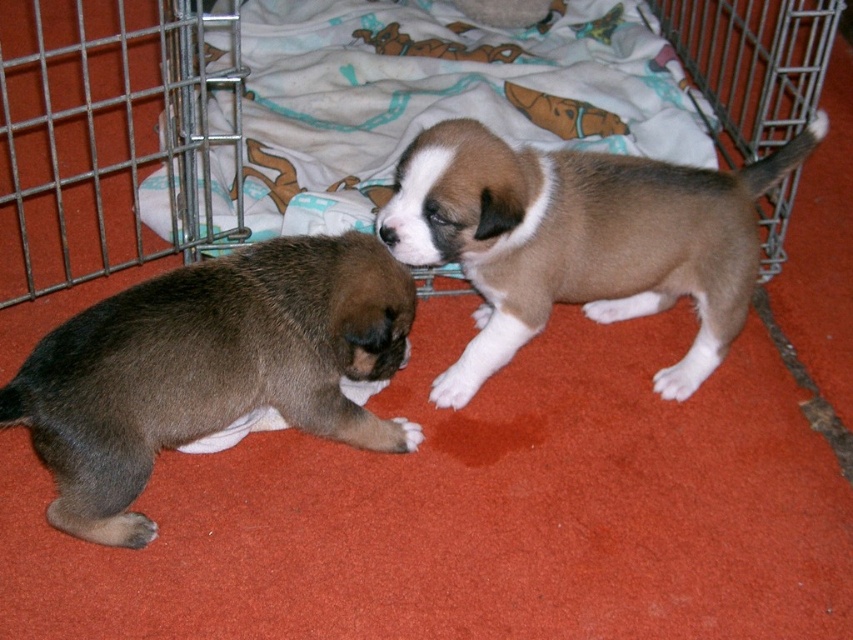
Can you confirm if brown fuzzy puppy at lower left is taller than brown fur puppy at center?

In fact, brown fuzzy puppy at lower left may be shorter than brown fur puppy at center.

Which of these two, brown fuzzy puppy at lower left or brown fur puppy at center, stands taller?

brown fur puppy at center is taller.

What are the coordinates of `brown fuzzy puppy at lower left` in the screenshot? It's located at (210, 369).

Find the location of a particular element. The height and width of the screenshot is (640, 853). brown fuzzy puppy at lower left is located at coordinates (210, 369).

Can you confirm if brown fuzzy puppy at lower left is thinner than metal wire cage at upper left?

Yes.

Does point (219, 333) come in front of point (108, 269)?

Yes, point (219, 333) is closer to viewer.

Image resolution: width=853 pixels, height=640 pixels. In order to click on brown fuzzy puppy at lower left in this screenshot , I will do `click(210, 369)`.

Can you confirm if brown fur puppy at center is thinner than metal wire cage at upper left?

Correct, brown fur puppy at center's width is less than metal wire cage at upper left's.

Which is behind, point (471, 269) or point (74, 188)?

Positioned behind is point (74, 188).

The image size is (853, 640). What are the coordinates of `brown fur puppy at center` in the screenshot? It's located at (579, 241).